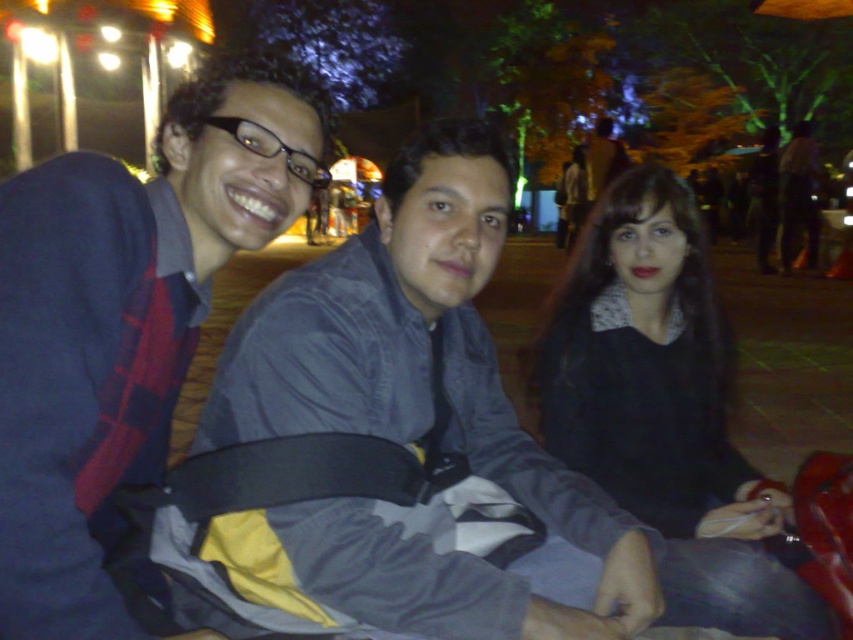
You are a fashion designer observing this nighttime scene. You need to determine which clothing item is shorter between the plaid fabric shirt at left and the black matte sweater at center. Which one should you choose?

The plaid fabric shirt at left is shorter than the black matte sweater at center, so you should choose the plaid fabric shirt at left as the shorter one.

Based on the scene description, where is the plaid fabric shirt at left located in terms of coordinates?

The plaid fabric shirt at left is located at coordinates point (126, 317).

You are standing in the park at night and see three people sitting together. The person on the left is wearing a dark jacket with a red plaid pattern on the inside. The person in the center is wearing a gray shirt. There is a point marked at coordinates (126, 317). Which person is closest to this point?

The point marked at (126, 317) corresponds to the plaid fabric shirt at left, so the person on the left is closest to this point.